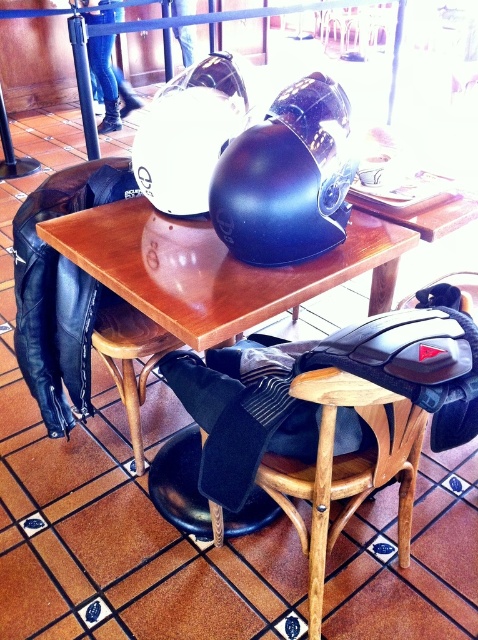
Question: Which point is closer to the camera?

Choices:
 (A) (307, 237)
 (B) (55, 330)
 (C) (310, 497)
 (D) (109, 330)

Answer: (C)

Question: From the image, what is the correct spatial relationship of glossy black helmet at center in relation to matte black helmet at center?

Choices:
 (A) left
 (B) right

Answer: (B)

Question: Which point is closer to the camera?

Choices:
 (A) (262, 189)
 (B) (203, 163)
 (C) (40, 390)

Answer: (A)

Question: Is wooden table at center below wooden chair at lower center?

Choices:
 (A) no
 (B) yes

Answer: (A)

Question: Which point is farther from the camera taking this photo?

Choices:
 (A) (147, 177)
 (B) (313, 516)
 (C) (201, 316)

Answer: (A)

Question: Is brown leather chair at center positioned at the back of matte black helmet at center?

Choices:
 (A) yes
 (B) no

Answer: (A)